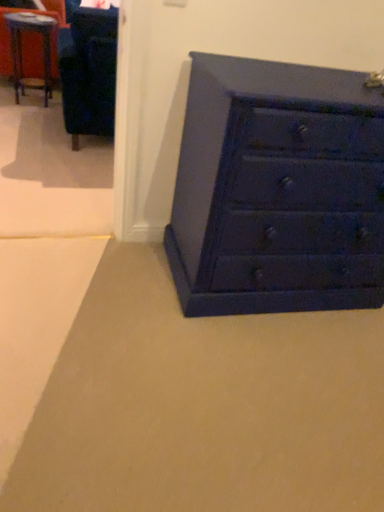
Identify the location of free location above matte blue chest of drawers at lower right (from a real-world perspective). (312, 77).